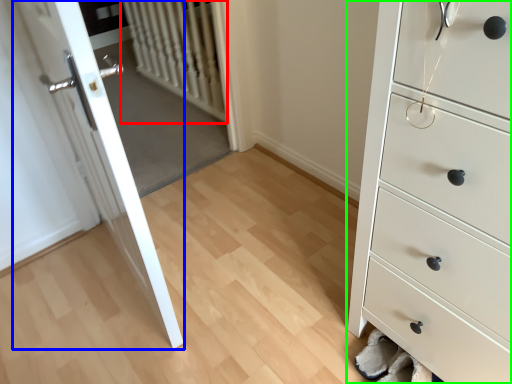
Question: Which is farther away from radiator (highlighted by a red box)? door (highlighted by a blue box) or chest of drawers (highlighted by a green box)?

Choices:
 (A) door
 (B) chest of drawers

Answer: (B)